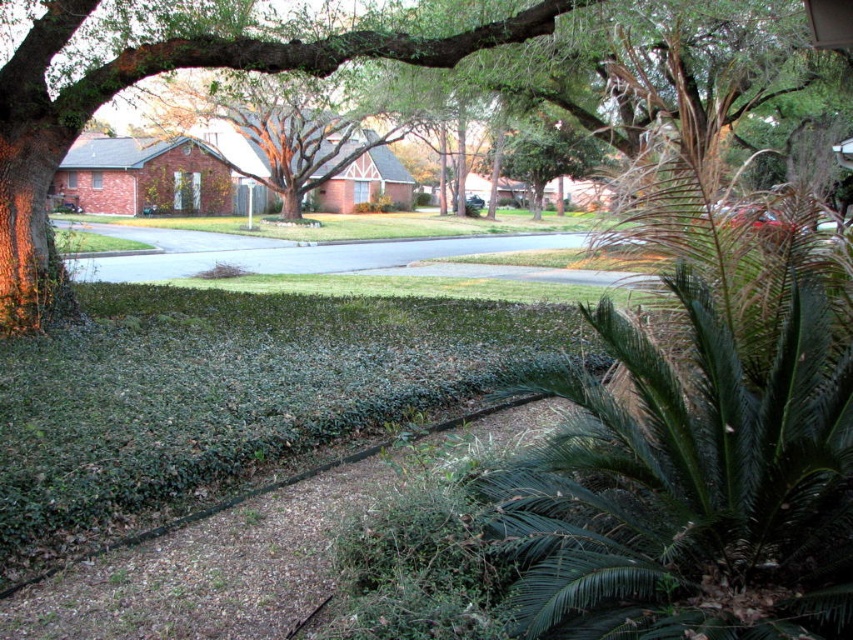
Does green leafy palm at lower right appear under green leafy tree at center?

Yes, green leafy palm at lower right is below green leafy tree at center.

Who is more distant from viewer, (711, 387) or (276, 42)?

The point (276, 42) is more distant.

Identify the location of green leafy palm at lower right. (689, 490).

The height and width of the screenshot is (640, 853). In order to click on green leafy palm at lower right in this screenshot , I will do `click(689, 490)`.

Between green leafy palm at lower right and gray asphalt road at center, which one appears on the left side from the viewer's perspective?

Positioned to the left is gray asphalt road at center.

Which is above, green leafy palm at lower right or gray asphalt road at center?

Positioned higher is gray asphalt road at center.

At what (x,y) coordinates should I click in order to perform the action: click on green leafy palm at lower right. Please return your answer as a coordinate pair (x, y). Looking at the image, I should click on (689, 490).

Between point (148, 68) and point (297, 268), which one is positioned behind?

The point (297, 268) is behind.

Can you confirm if green leafy tree at center is positioned above gray asphalt road at center?

No, green leafy tree at center is not above gray asphalt road at center.

Find the location of a particular element. The width and height of the screenshot is (853, 640). green leafy tree at center is located at coordinates (157, 74).